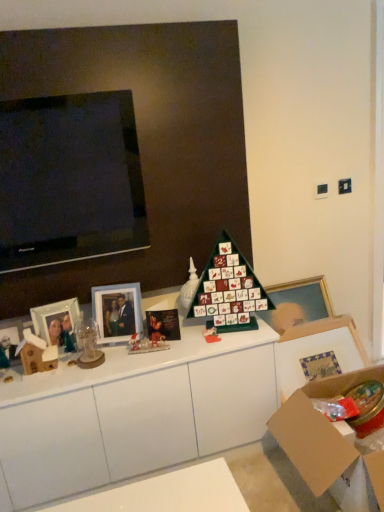
Locate an element on the screen. free point below green matte advent calendar at center (from a real-world perspective) is located at coordinates (219, 330).